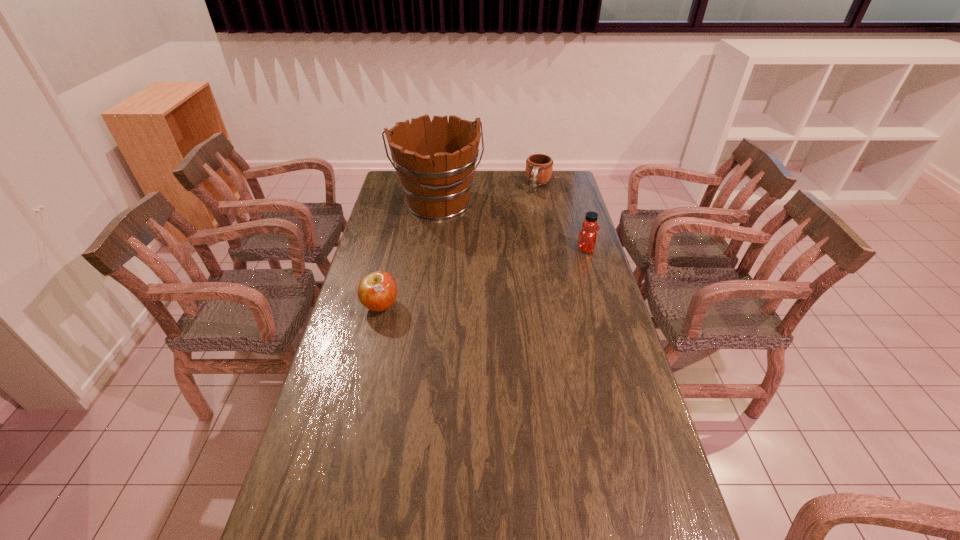
At what (x,y) coordinates should I click in order to perform the action: click on vacant region between the mug and the tallest object. Please return your answer as a coordinate pair (x, y). Looking at the image, I should click on (489, 194).

This screenshot has width=960, height=540. What are the coordinates of `vacant space that is in between the tallest object and the apple` in the screenshot? It's located at (410, 255).

This screenshot has height=540, width=960. Identify the location of free space that is in between the nearest object and the mug. (460, 246).

Where is `vacant space that is in between the apple and the wine bucket`? The image size is (960, 540). vacant space that is in between the apple and the wine bucket is located at coordinates (410, 255).

Where is `free space between the tallest object and the apple`? This screenshot has height=540, width=960. free space between the tallest object and the apple is located at coordinates (410, 255).

Identify which object is the third nearest to the tallest object. Please provide its 2D coordinates. Your answer should be formatted as a tuple, i.e. [(x, y)], where the tuple contains the x and y coordinates of a point satisfying the conditions above.

[(377, 291)]

Locate which object ranks second in proximity to the nearest object. Please provide its 2D coordinates. Your answer should be formatted as a tuple, i.e. [(x, y)], where the tuple contains the x and y coordinates of a point satisfying the conditions above.

[(587, 238)]

This screenshot has width=960, height=540. What are the coordinates of `vacant point that satisfies the following two spatial constraints: 1. on the front side of the mug; 2. on the front label of the honey` in the screenshot? It's located at (551, 249).

Identify the location of free location that satisfies the following two spatial constraints: 1. on the front side of the tallest object; 2. on the front label of the third farthest object. Image resolution: width=960 pixels, height=540 pixels. (434, 249).

Find the location of a particular element. The image size is (960, 540). vacant region that satisfies the following two spatial constraints: 1. on the front side of the wine bucket; 2. on the front label of the honey is located at coordinates (434, 249).